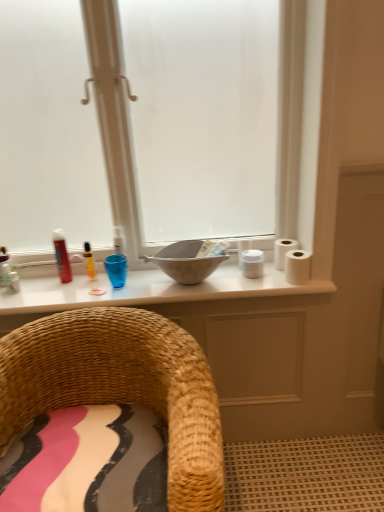
Question: From the image's perspective, is matte red can at left, acting as the 2th toiletry starting from the right, above yellow plastic marker at upper center, which is counted as the second toiletry, starting from the left?

Choices:
 (A) yes
 (B) no

Answer: (A)

Question: Does matte red can at left, acting as the 2th toiletry starting from the right, come behind yellow plastic marker at upper center, which is counted as the second toiletry, starting from the left?

Choices:
 (A) no
 (B) yes

Answer: (A)

Question: Does matte red can at left, acting as the 2th toiletry starting from the right, appear on the right side of yellow plastic marker at upper center, which is counted as the second toiletry, starting from the left?

Choices:
 (A) yes
 (B) no

Answer: (B)

Question: Is matte red can at left, acting as the 2th toiletry starting from the right, positioned with its back to yellow plastic marker at upper center, which ranks as the first toiletry in right-to-left order?

Choices:
 (A) no
 (B) yes

Answer: (A)

Question: Would you say matte red can at left, acting as the 2th toiletry starting from the right, is a long distance from yellow plastic marker at upper center, which ranks as the first toiletry in right-to-left order?

Choices:
 (A) no
 (B) yes

Answer: (A)

Question: In the image, is woven straw chair at lower left positioned in front of or behind matte red can at left, the 1th toiletry viewed from the left?

Choices:
 (A) front
 (B) behind

Answer: (A)

Question: Is woven straw chair at lower left to the left or to the right of matte red can at left, acting as the 2th toiletry starting from the right, in the image?

Choices:
 (A) right
 (B) left

Answer: (A)

Question: In terms of height, does woven straw chair at lower left look taller or shorter compared to matte red can at left, the 1th toiletry viewed from the left?

Choices:
 (A) short
 (B) tall

Answer: (B)

Question: From the image's perspective, relative to matte red can at left, the 1th toiletry viewed from the left, is woven straw chair at lower left above or below?

Choices:
 (A) above
 (B) below

Answer: (B)

Question: From a real-world perspective, is matte gray bowl at center positioned above or below white matte toilet paper at right, arranged as the 2th toilet paper when viewed from the back?

Choices:
 (A) above
 (B) below

Answer: (A)

Question: From their relative heights in the image, would you say matte gray bowl at center is taller or shorter than white matte toilet paper at right, the 1th toilet paper from the front?

Choices:
 (A) short
 (B) tall

Answer: (B)

Question: Looking at the image, does matte gray bowl at center seem bigger or smaller compared to white matte toilet paper at right, arranged as the 2th toilet paper when viewed from the back?

Choices:
 (A) small
 (B) big

Answer: (B)

Question: From the image's perspective, is matte gray bowl at center located above or below white matte toilet paper at right, arranged as the 2th toilet paper when viewed from the back?

Choices:
 (A) below
 (B) above

Answer: (B)

Question: From a real-world perspective, is matte red can at left, the 1th toiletry viewed from the left, physically located above or below white matte toilet paper at right, the 2th toilet paper viewed from the front?

Choices:
 (A) above
 (B) below

Answer: (A)

Question: Looking at their shapes, would you say matte red can at left, the 1th toiletry viewed from the left, is wider or thinner than white matte toilet paper at right, the 2th toilet paper viewed from the front?

Choices:
 (A) wide
 (B) thin

Answer: (B)